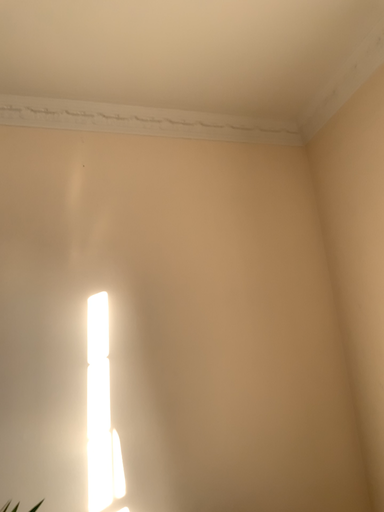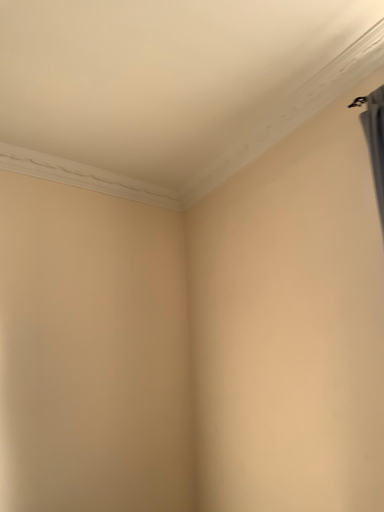
Question: How did the camera likely rotate when shooting the video?

Choices:
 (A) rotated left
 (B) rotated right

Answer: (B)